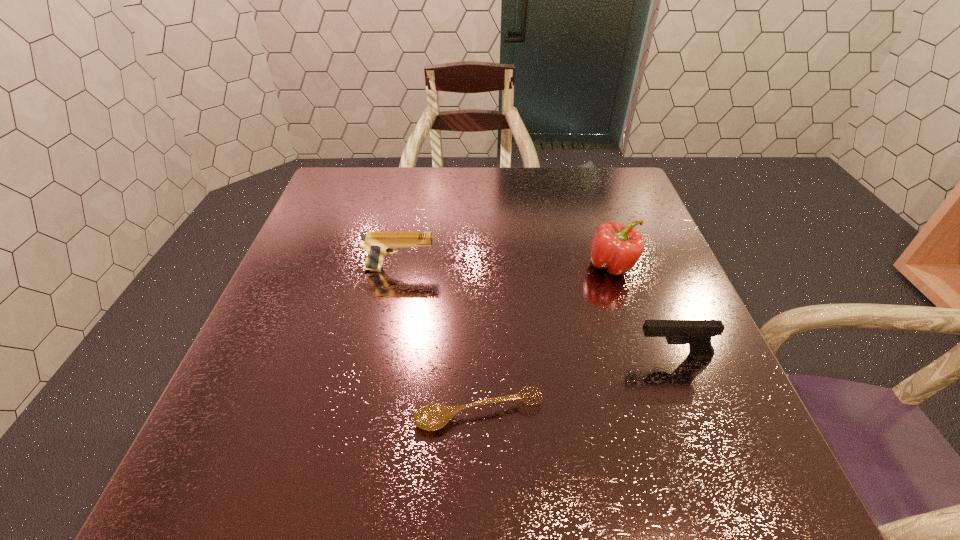
Locate an element on the screen. vacant space that satisfies the following two spatial constraints: 1. at the barrel of the left pistol; 2. on the back side of the ladle is located at coordinates (372, 413).